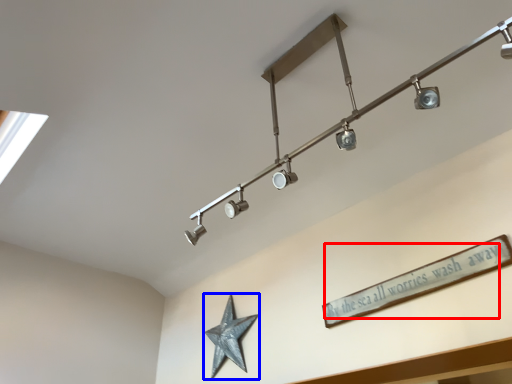
Question: Which object is further to the camera taking this photo, writing (highlighted by a red box) or star (highlighted by a blue box)?

Choices:
 (A) writing
 (B) star

Answer: (B)